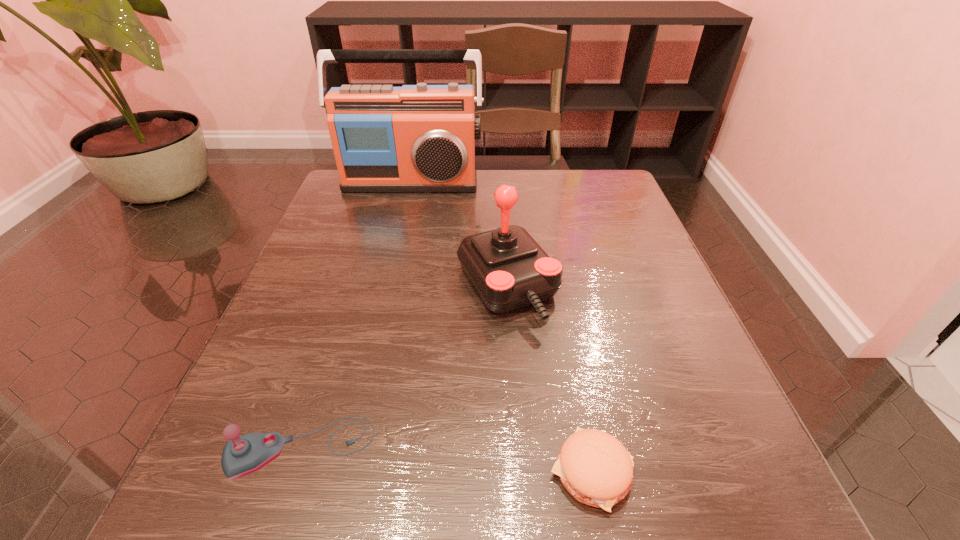
What are the coordinates of `the tallest object` in the screenshot? It's located at (416, 138).

This screenshot has width=960, height=540. What are the coordinates of `radio receiver` in the screenshot? It's located at (416, 138).

Image resolution: width=960 pixels, height=540 pixels. I want to click on the right joystick, so click(x=507, y=267).

Where is `the farther joystick`? the farther joystick is located at coordinates (507, 267).

I want to click on the third tallest object, so click(x=243, y=455).

You are a GUI agent. You are given a task and a screenshot of the screen. Output one action in this format:
    pyautogui.click(x=<x>, y=<y>)
    Task: Click on the shorter joystick
    
    Given the screenshot: What is the action you would take?
    pyautogui.click(x=243, y=455)

This screenshot has width=960, height=540. I want to click on patty, so click(x=596, y=469).

Find the location of a particular element. vacant position located 0.130m on the front-facing side of the radio receiver is located at coordinates (400, 226).

Where is `vacant point located on the left of the third nearest object`? vacant point located on the left of the third nearest object is located at coordinates (300, 286).

Where is `vacant space located 0.280m on the right of the second shortest object`? vacant space located 0.280m on the right of the second shortest object is located at coordinates (584, 448).